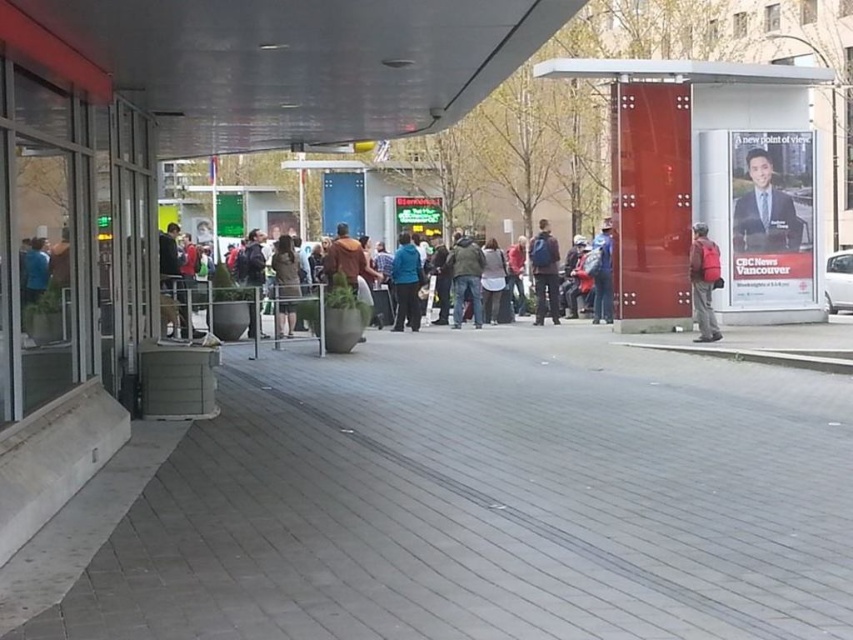
You are a delivery person who needs to deliver a package to the building entrance. You see a teal fabric jacket at center and a matte blue backpack at center. Which item is closer to the ground?

The teal fabric jacket at center is closer to the ground because it is below the matte blue backpack at center.